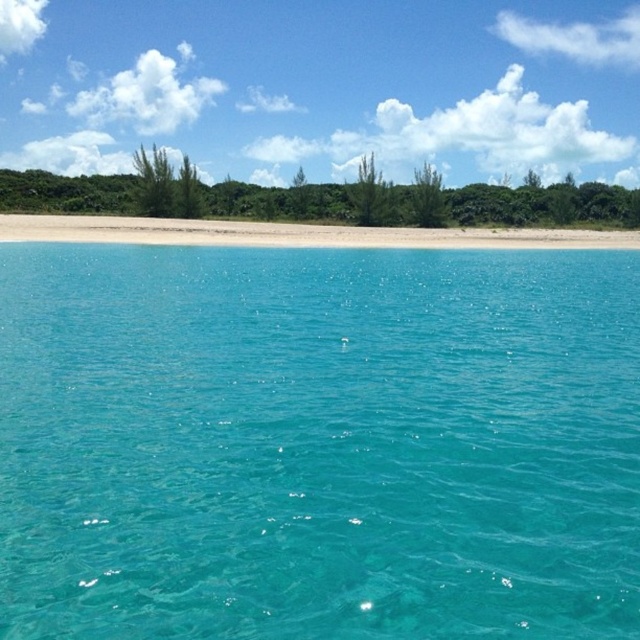
The width and height of the screenshot is (640, 640). I want to click on turquoise glossy water at center, so click(317, 444).

Is point (250, 298) positioned in front of point (60, 230)?

Yes, it is.

This screenshot has width=640, height=640. Find the location of `turquoise glossy water at center`. turquoise glossy water at center is located at coordinates (x=317, y=444).